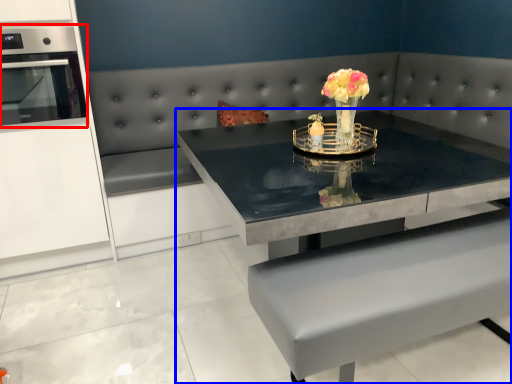
Question: Which of the following is the farthest to the observer, appliance (highlighted by a red box) or table (highlighted by a blue box)?

Choices:
 (A) appliance
 (B) table

Answer: (A)